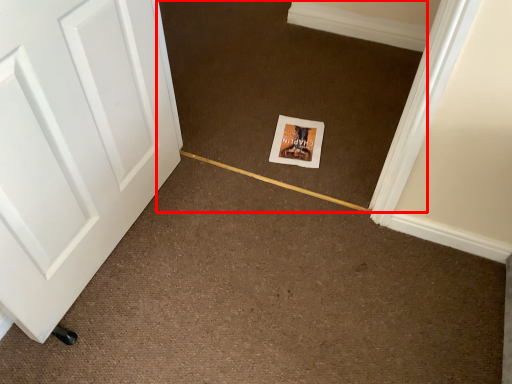
Question: From the image's perspective, what is the correct spatial relationship of plain (annotated by the red box) in relation to postcard?

Choices:
 (A) below
 (B) above

Answer: (B)